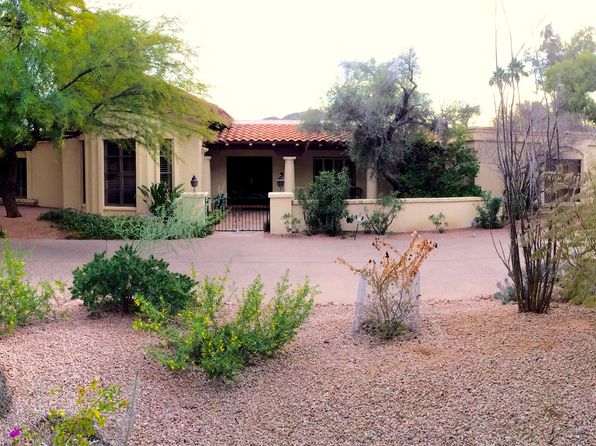
This screenshot has width=596, height=446. Find the location of `black urns`. black urns is located at coordinates (195, 180), (281, 180).